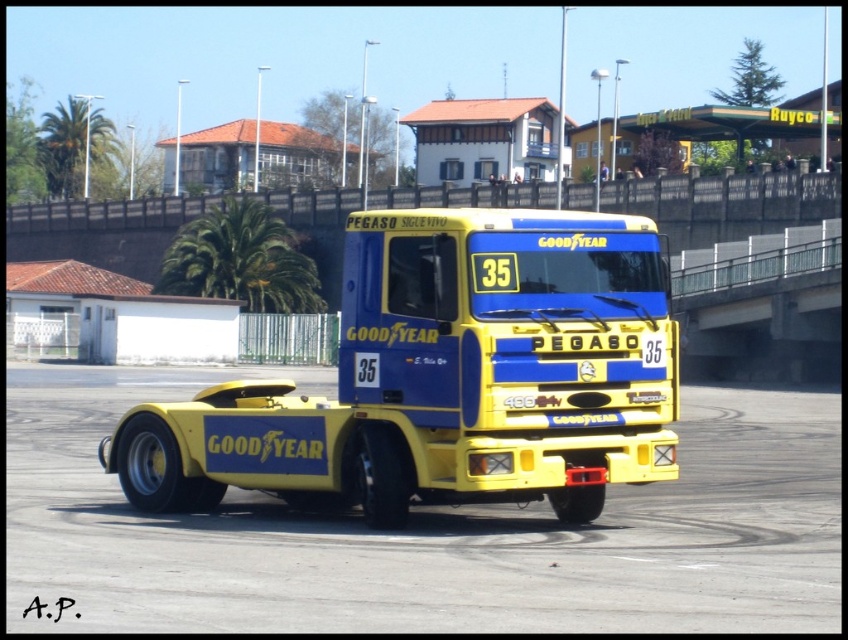
You are driving a car and want to avoid hitting the yellow rubber dirt track at center and the yellow matte tow truck at center. Which one should you steer to the left to avoid?

You should steer to the left to avoid the yellow rubber dirt track at center because it is located to the right of the yellow matte tow truck at center.

You are a photographer trying to capture the yellow matte tow truck at center and the shiny silver tire at lower left in a single shot. Based on their positions, which object will appear closer to the camera in your photo?

The yellow matte tow truck at center appears closer to the camera because it is positioned in front of the shiny silver tire at lower left.

You are a delivery person who needs to load a package onto the shiny silver tire at lower left. The yellow matte tow truck at center is blocking your path. Can you move the truck to access the tire?

The yellow matte tow truck at center is 25.01 inches away from the shiny silver tire at lower left. Since the distance is more than 24 inches, you can move the truck to access the tire.